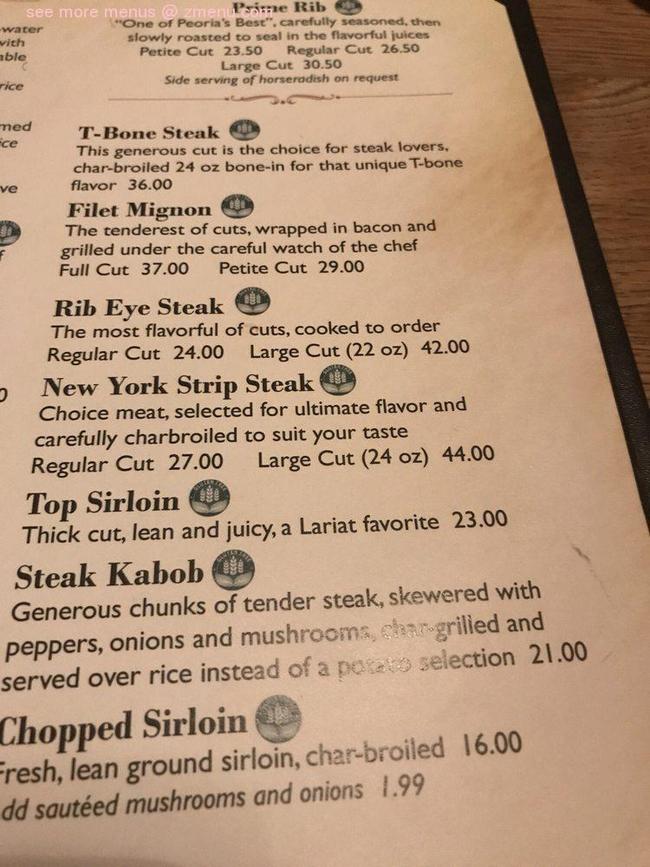
Where is `table`? The width and height of the screenshot is (650, 867). table is located at coordinates (614, 170).